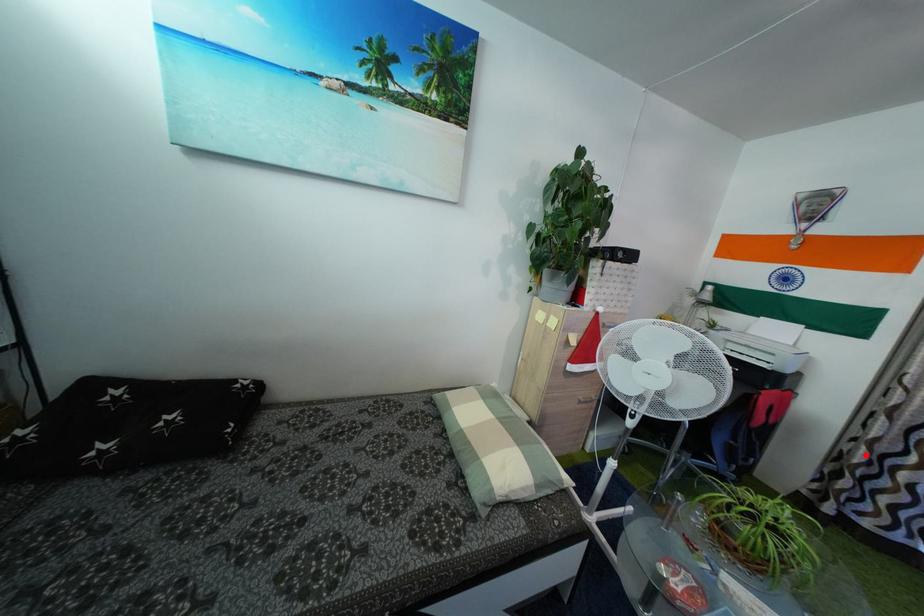
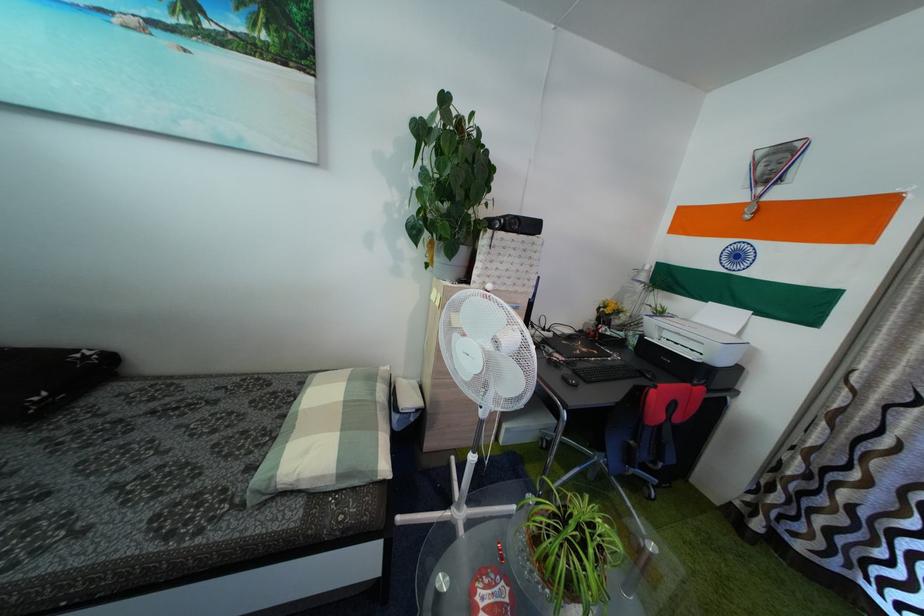
Find the pixel in the second image that matches the highlighted location in the first image.

(801, 464)